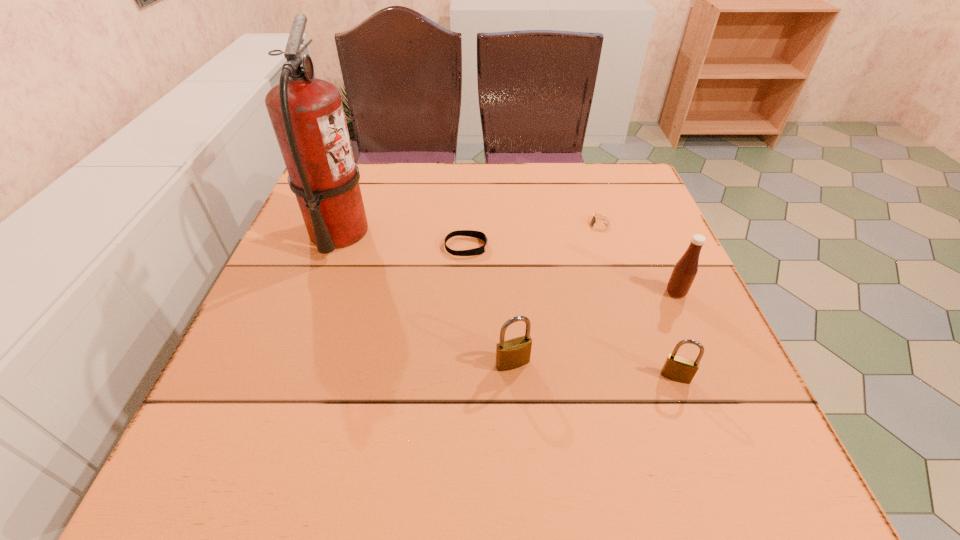
This screenshot has height=540, width=960. In the image, there is a desktop. In order to click on vacant region at the far left corner in this screenshot , I will do tap(369, 174).

Find the location of a particular element. free region at the far right corner of the desktop is located at coordinates (637, 197).

The height and width of the screenshot is (540, 960). Identify the location of free space at the near right corner. (698, 418).

This screenshot has width=960, height=540. In order to click on free area in between the second object from left to right and the right padlock in this screenshot , I will do `click(571, 312)`.

At what (x,y) coordinates should I click in order to perform the action: click on free space between the wristband and the fourth object from right to left. Please return your answer as a coordinate pair (x, y). The image size is (960, 540). Looking at the image, I should click on (490, 305).

Identify the location of vacant space that is in between the fire extinguisher and the shorter padlock. (507, 305).

Locate an element on the screen. Image resolution: width=960 pixels, height=540 pixels. free space between the third tallest object and the watch is located at coordinates (556, 294).

Image resolution: width=960 pixels, height=540 pixels. Find the location of `empty space between the tallest object and the fifth object from right to left`. empty space between the tallest object and the fifth object from right to left is located at coordinates (402, 240).

At what (x,y) coordinates should I click in order to perform the action: click on empty location between the third shortest object and the taller padlock. Please return your answer as a coordinate pair (x, y). The height and width of the screenshot is (540, 960). Looking at the image, I should click on (594, 370).

At what (x,y) coordinates should I click in order to perform the action: click on free space between the fire extinguisher and the rightmost object. Please return your answer as a coordinate pair (x, y). Looking at the image, I should click on (507, 262).